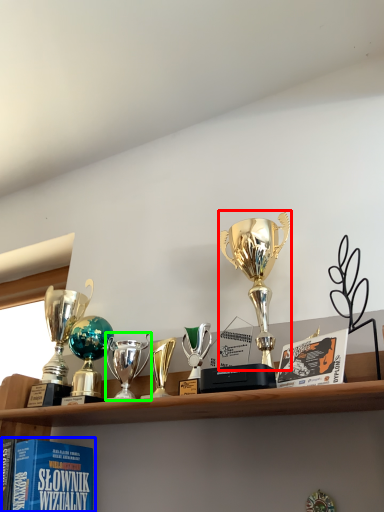
Question: Based on their relative distances, which object is farther from trophy (highlighted by a red box)? Choose from book (highlighted by a blue box) and trophy (highlighted by a green box).

Choices:
 (A) book
 (B) trophy

Answer: (A)